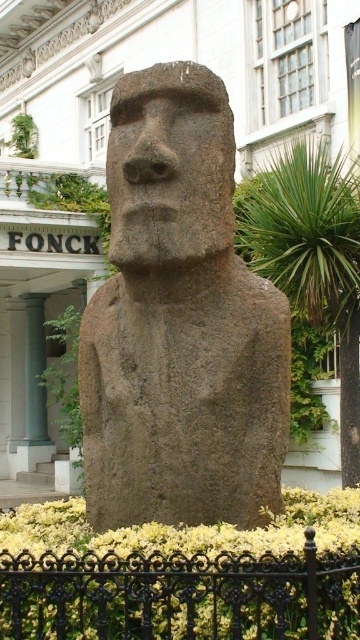
Is point (167, 417) positioned behind point (39, 372)?

No, (167, 417) is closer to viewer.

Does brown stone statue at center have a larger size compared to green stone column at left?

Incorrect, brown stone statue at center is not larger than green stone column at left.

Locate an element on the screen. This screenshot has height=640, width=360. brown stone statue at center is located at coordinates (180, 323).

Between brown stone statue at center and brown stone head at center, which one appears on the left side from the viewer's perspective?

A: brown stone head at center is more to the left.

Between brown stone statue at center and brown stone head at center, which one is positioned higher?

brown stone head at center

Is point (123, 141) positioned after point (156, 264)?

Yes.

Identify the location of brown stone statue at center. The width and height of the screenshot is (360, 640). (180, 323).

Which is behind, point (106, 161) or point (33, 406)?

The point (33, 406) is behind.

Who is more forward, (119,262) or (27,397)?

Point (119,262)

This screenshot has height=640, width=360. In order to click on brown stone head at center in this screenshot , I will do `click(169, 166)`.